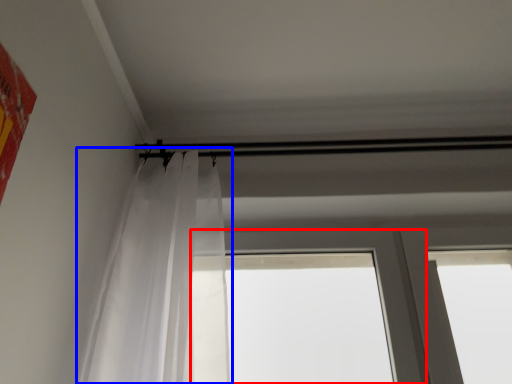
Question: Which point is closer to the camera, window (highlighted by a red box) or curtain (highlighted by a blue box)?

Choices:
 (A) window
 (B) curtain

Answer: (B)